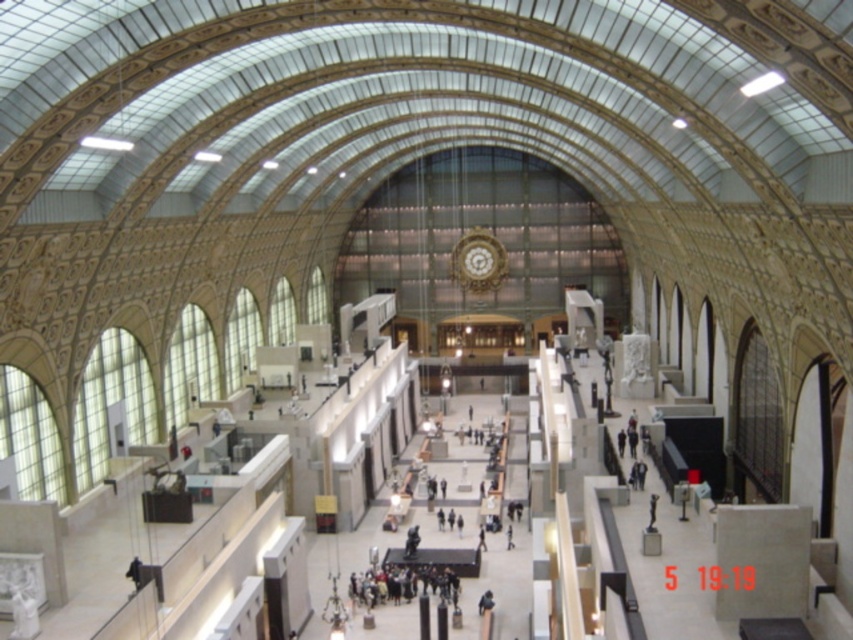
You are standing in the grand building and want to locate two specific points marked on the floor. The first point is at coordinates point (357, 595) and the second is at point (451, 273). Which of these two points is closer to your current position?

Point (357, 595) is closer to the viewer than point (451, 273), so the first point is nearer to your current position.

You are an interior designer planning to place a new sculpture in the atrium. The sculpture requires a space wider than the dark gray fabric group at center. Will the gold textured clock at center provide enough width for the sculpture?

The dark gray fabric group at center is narrower than the gold textured clock at center, so the gold textured clock at center has sufficient width to accommodate the sculpture.